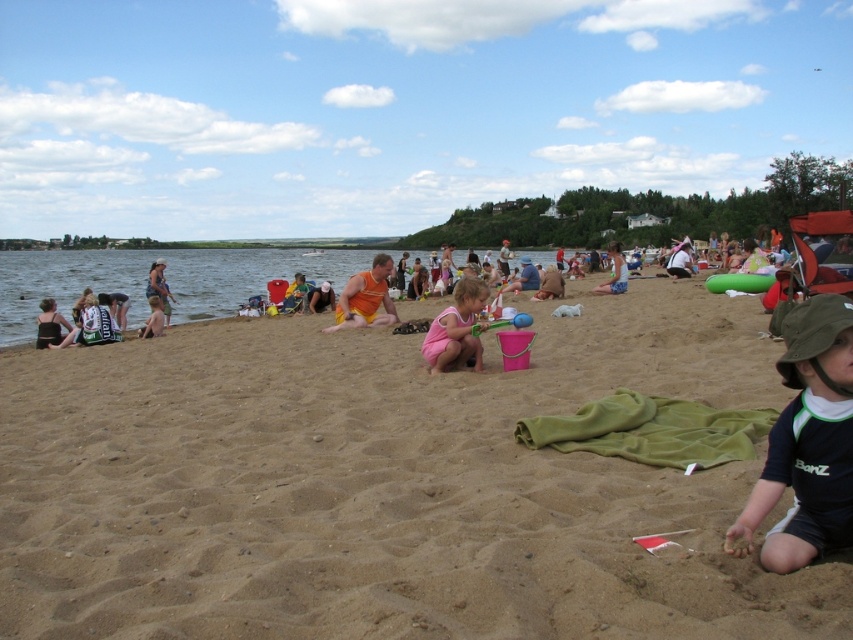
You are standing on the beach and want to take a photo of the two points marked in the scene. Which point, point (798, 310) or point (605, 288), will appear larger in your photo?

Point (798, 310) will appear larger in the photo because it is closer to the camera than point (605, 288).